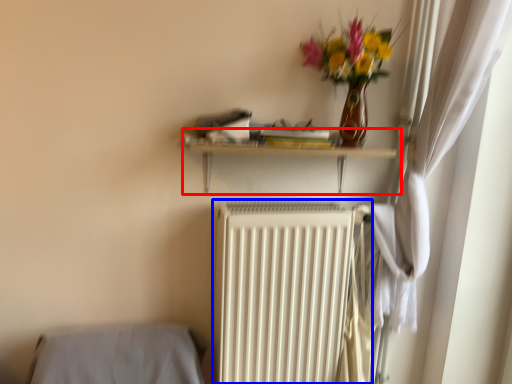
Question: Which object is closer to the camera taking this photo, shelf (highlighted by a red box) or radiator (highlighted by a blue box)?

Choices:
 (A) shelf
 (B) radiator

Answer: (A)